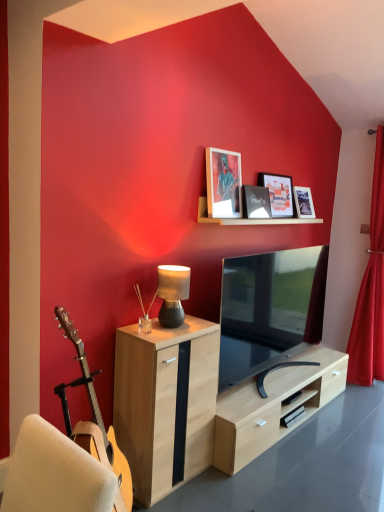
You are a GUI agent. You are given a task and a screenshot of the screen. Output one action in this format:
    pyautogui.click(x=<x>, y=<y>)
    Task: Click on the free spot in front of matte black lamp at center
    The width and height of the screenshot is (384, 512).
    Given the screenshot: What is the action you would take?
    pyautogui.click(x=162, y=331)